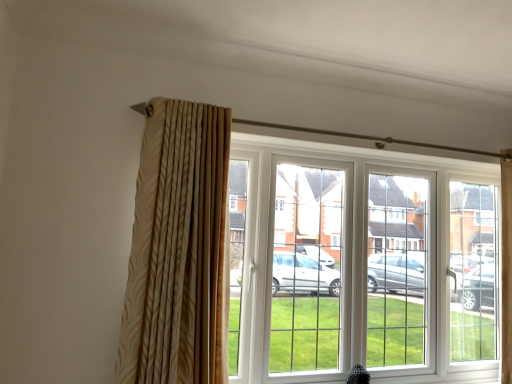
Question: Is white plastic window at center a part of beige textured curtain at left?

Choices:
 (A) yes
 (B) no

Answer: (B)

Question: Can you confirm if beige textured curtain at left is bigger than white plastic window at center?

Choices:
 (A) yes
 (B) no

Answer: (B)

Question: Is beige textured curtain at left in front of white plastic window at center?

Choices:
 (A) no
 (B) yes

Answer: (B)

Question: From a real-world perspective, is beige textured curtain at left physically above white plastic window at center?

Choices:
 (A) no
 (B) yes

Answer: (B)

Question: Is beige textured curtain at left to the left of white plastic window at center from the viewer's perspective?

Choices:
 (A) no
 (B) yes

Answer: (B)

Question: From the image's perspective, is beige textured curtain at left beneath white plastic window at center?

Choices:
 (A) no
 (B) yes

Answer: (A)

Question: Is white plastic window at center not close to beige textured curtain at left?

Choices:
 (A) yes
 (B) no

Answer: (B)

Question: Is white plastic window at center taller than beige textured curtain at left?

Choices:
 (A) no
 (B) yes

Answer: (B)

Question: Could you tell me if white plastic window at center is facing beige textured curtain at left?

Choices:
 (A) yes
 (B) no

Answer: (B)

Question: Does white plastic window at center appear on the left side of beige textured curtain at left?

Choices:
 (A) yes
 (B) no

Answer: (B)

Question: Considering the relative sizes of white plastic window at center and beige textured curtain at left in the image provided, is white plastic window at center shorter than beige textured curtain at left?

Choices:
 (A) yes
 (B) no

Answer: (B)

Question: Does white plastic window at center have a greater width compared to beige textured curtain at left?

Choices:
 (A) no
 (B) yes

Answer: (B)

Question: From their relative heights in the image, would you say white plastic window at center is taller or shorter than beige textured curtain at left?

Choices:
 (A) short
 (B) tall

Answer: (B)